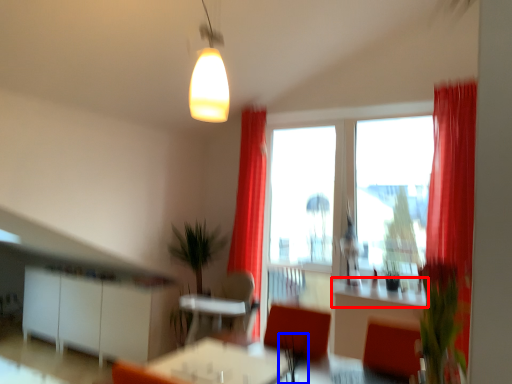
Question: Which point is further to the camera, counter top (highlighted by a red box) or plant (highlighted by a blue box)?

Choices:
 (A) counter top
 (B) plant

Answer: (A)